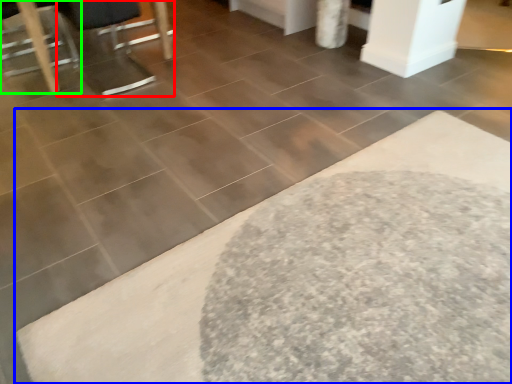
Question: Estimate the real-world distances between objects in this image. Which object is farther from swivel chair (highlighted by a red box), bath mat (highlighted by a blue box) or furniture (highlighted by a green box)?

Choices:
 (A) bath mat
 (B) furniture

Answer: (A)